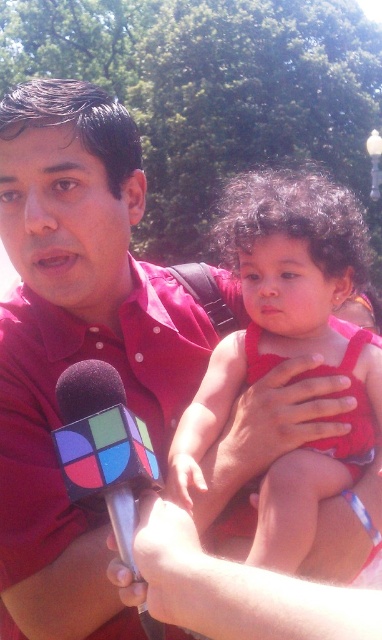
Based on the photo, can you confirm if matte red dress at center is shorter than rubberized plastic microphone at lower left?

No.

Is point (338, 362) in front of point (119, 461)?

No, (338, 362) is behind (119, 461).

Where is `matte red dress at center`? This screenshot has width=382, height=640. matte red dress at center is located at coordinates (288, 346).